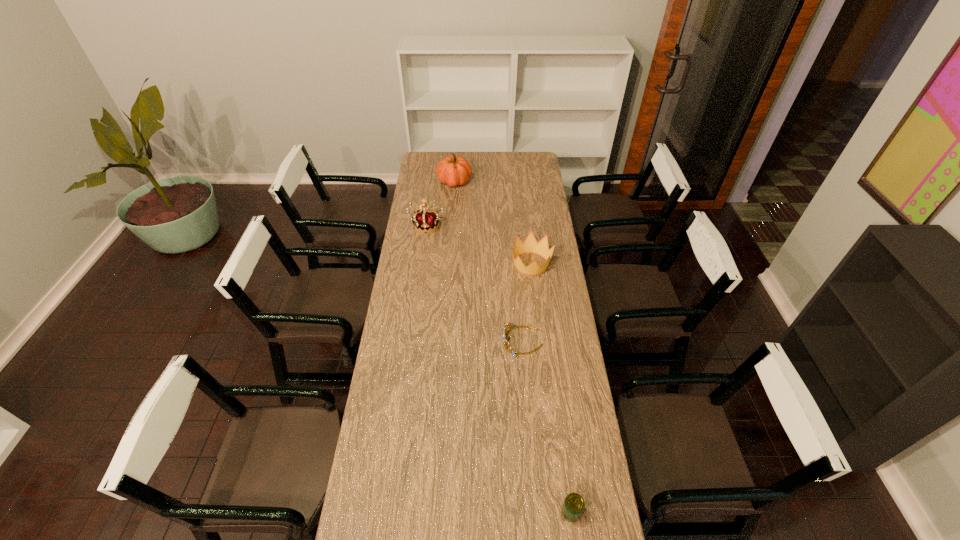
Where is `pumpkin`? Image resolution: width=960 pixels, height=540 pixels. pumpkin is located at coordinates (453, 170).

Image resolution: width=960 pixels, height=540 pixels. I want to click on the fourth nearest object, so click(x=425, y=219).

This screenshot has width=960, height=540. Identify the location of the farther tiara. (425, 219).

The image size is (960, 540). I want to click on the third farthest object, so click(530, 245).

Find the location of a particular element. crown is located at coordinates click(530, 245).

Image resolution: width=960 pixels, height=540 pixels. In order to click on the fourth farthest object in this screenshot , I will do `click(507, 345)`.

Identify the location of the shorter tiara. Image resolution: width=960 pixels, height=540 pixels. (507, 345).

The width and height of the screenshot is (960, 540). I want to click on beer can, so click(x=573, y=506).

Where is `vacant position located on the left of the pumpkin`? vacant position located on the left of the pumpkin is located at coordinates (428, 182).

This screenshot has width=960, height=540. In order to click on free space located on the front-facing side of the left tiara in this screenshot , I will do `click(420, 275)`.